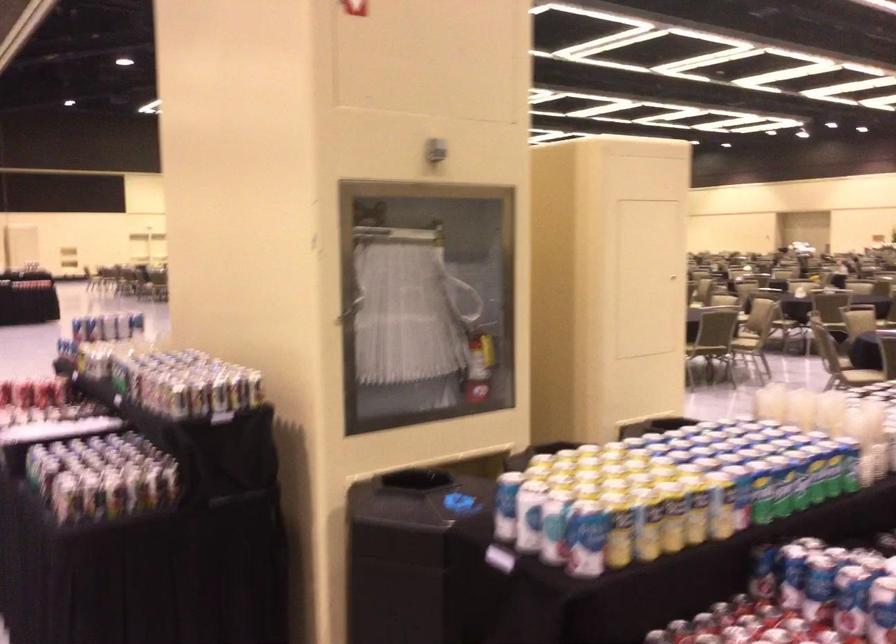
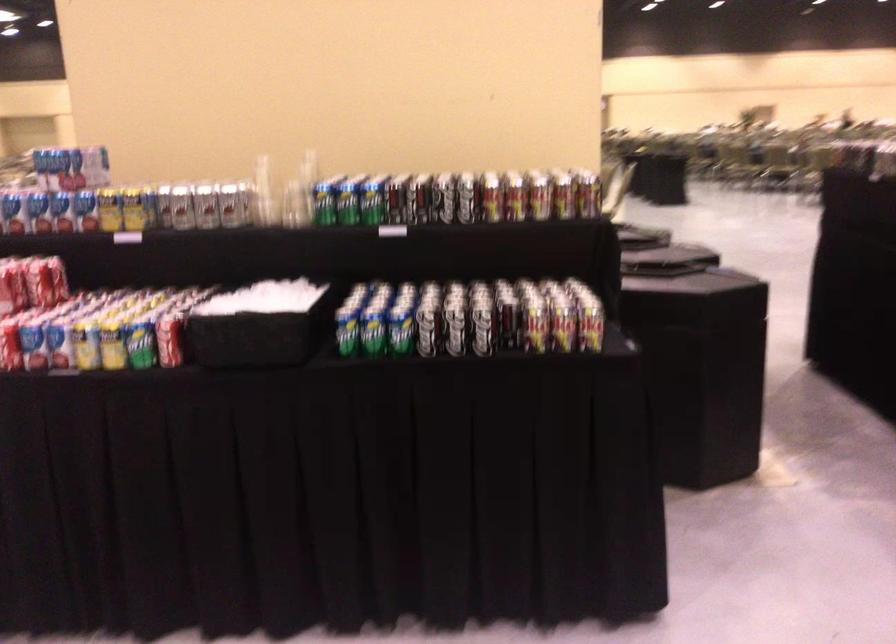
The point at (115, 348) is marked in the first image. Where is the corresponding point in the second image?

(228, 205)